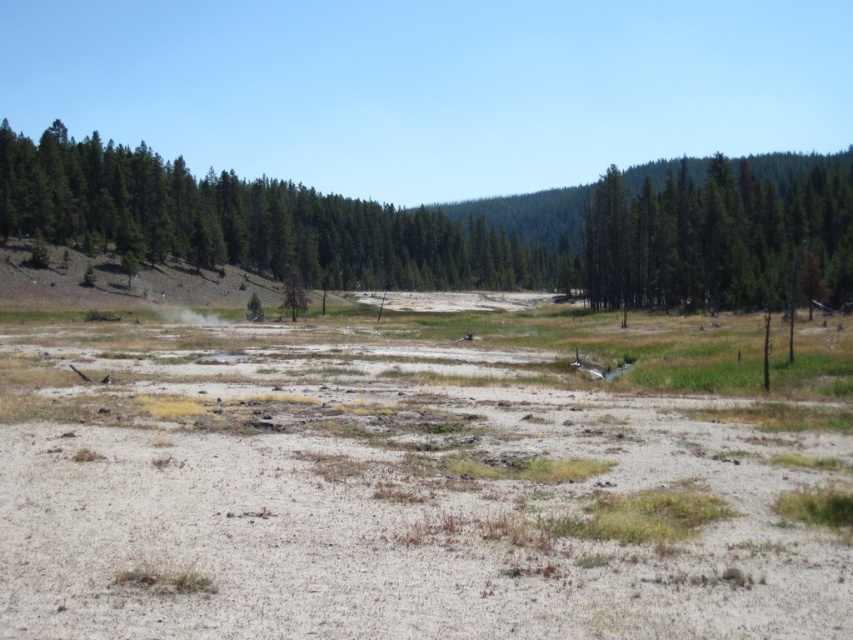
Is dull gray sand at center bigger than green matte tree at upper left?

Incorrect, dull gray sand at center is not larger than green matte tree at upper left.

Is the position of dull gray sand at center more distant than that of green matte tree at upper left?

No, it is not.

Between point (410, 531) and point (166, 170), which one is positioned in front?

Point (410, 531)

You are a GUI agent. You are given a task and a screenshot of the screen. Output one action in this format:
    pyautogui.click(x=<x>, y=<y>)
    Task: Click on the dull gray sand at center
    
    Given the screenshot: What is the action you would take?
    pyautogui.click(x=405, y=486)

Does green matte tree at upper left have a smaller size compared to white vapor at center?

No.

Find the location of a particular element. green matte tree at upper left is located at coordinates (248, 221).

Who is more forward, (x=821, y=582) or (x=780, y=188)?

Point (x=821, y=582) is more forward.

Is dull gray sand at center positioned at the back of green matte tree at upper right?

No, dull gray sand at center is in front of green matte tree at upper right.

I want to click on dull gray sand at center, so click(405, 486).

I want to click on dull gray sand at center, so click(x=405, y=486).